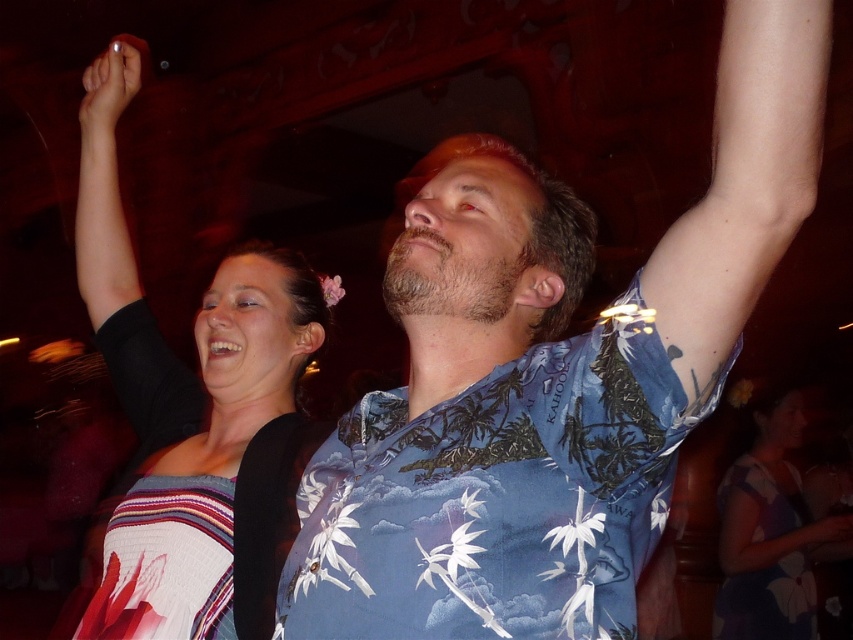
You are standing at point (804, 419) and want to take a photo of the two people at the party. The camera you have can focus on subjects within 15 feet. Will the camera be able to capture them clearly?

The point (804, 419) and camera are 14.88 feet apart from each other, so yes, the camera can capture them clearly since the distance is within the 15 feet focus range.

You are at the party and want to take a photo of both the woman and the man. You notice two points marked as point [376,604] and point [792,483]. Which point should you focus on first if you want to capture both subjects in the frame?

Point [376,604] is in front of point [792,483], so you should focus on point [376,604] first to ensure both subjects are in the frame.

You are an artist trying to sketch the scene. You need to place the matte black hand at upper left in your drawing. Where should you position it on the canvas using coordinates? Please provide the coordinates as a tuple in the format of a pair of numbers within parentheses, like this example format without quotes or any other text.

The matte black hand at upper left should be positioned at coordinates approximately at point (109, 86).